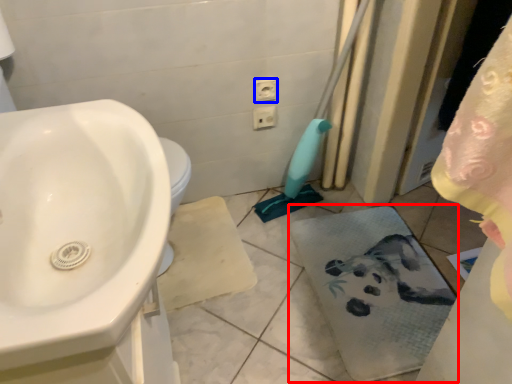
Question: Which of the following is the farthest to the observer, bath towel (highlighted by a red box) or electric outlet (highlighted by a blue box)?

Choices:
 (A) bath towel
 (B) electric outlet

Answer: (B)